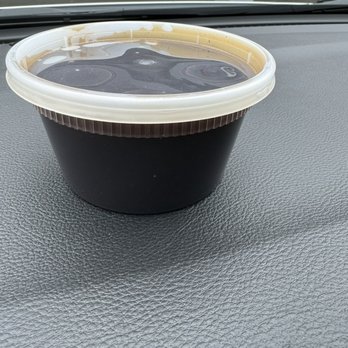
You are a GUI agent. You are given a task and a screenshot of the screen. Output one action in this format:
    pyautogui.click(x=<x>, y=<y>)
    Task: Click on the edge of plastic cup
    The image size is (348, 348).
    Given the screenshot: What is the action you would take?
    pyautogui.click(x=171, y=109)